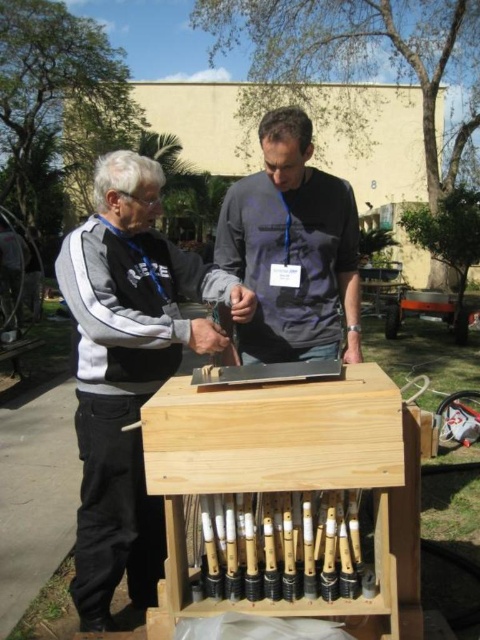
Question: In this image, where is wooden table at center located relative to dark gray matte shirt at center?

Choices:
 (A) below
 (B) above

Answer: (A)

Question: Does wooden table at center have a lesser width compared to dark gray matte shirt at center?

Choices:
 (A) no
 (B) yes

Answer: (A)

Question: Which point is farther from the camera taking this photo?

Choices:
 (A) (352, 216)
 (B) (251, 288)

Answer: (A)

Question: Can you confirm if wooden table at center is wider than dark gray matte shirt at center?

Choices:
 (A) yes
 (B) no

Answer: (A)

Question: Which object appears farthest from the camera in this image?

Choices:
 (A) wooden table at center
 (B) dark gray matte shirt at center

Answer: (B)

Question: Among these points, which one is nearest to the camera?

Choices:
 (A) [250, 212]
 (B) [276, 323]

Answer: (A)